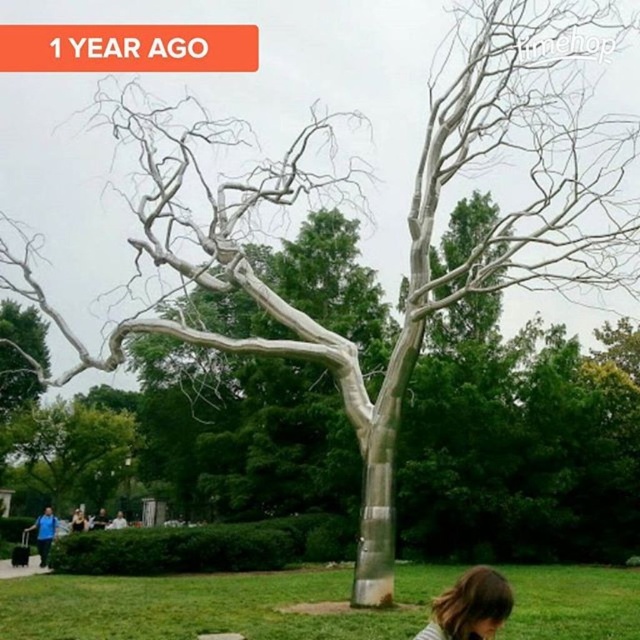
Is green grass at lower center below brown hair at lower center?

Correct, green grass at lower center is located below brown hair at lower center.

Describe the element at coordinates (209, 605) in the screenshot. Image resolution: width=640 pixels, height=640 pixels. I see `green grass at lower center` at that location.

Locate an element on the screen. Image resolution: width=640 pixels, height=640 pixels. green grass at lower center is located at coordinates (209, 605).

Who is more distant from viewer, (529, 625) or (93, 497)?

Point (93, 497)

Is green grass at lower center shorter than silver metallic tree at center?

In fact, green grass at lower center may be taller than silver metallic tree at center.

Between point (566, 605) and point (68, 406), which one is positioned behind?

The point (68, 406) is more distant.

What are the coordinates of `green grass at lower center` in the screenshot? It's located at click(x=209, y=605).

Who is more distant from viewer, (525, 627) or (81, 513)?

The point (81, 513) is behind.

Can you confirm if green grass at lower center is thinner than matte black hair at lower center?

Incorrect, green grass at lower center's width is not less than matte black hair at lower center's.

Does point (320, 634) lie in front of point (83, 518)?

Yes, it is.

You are a GUI agent. You are given a task and a screenshot of the screen. Output one action in this format:
    pyautogui.click(x=<x>, y=<y>)
    Task: Click on the green grass at lower center
    The width and height of the screenshot is (640, 640).
    Given the screenshot: What is the action you would take?
    pyautogui.click(x=209, y=605)